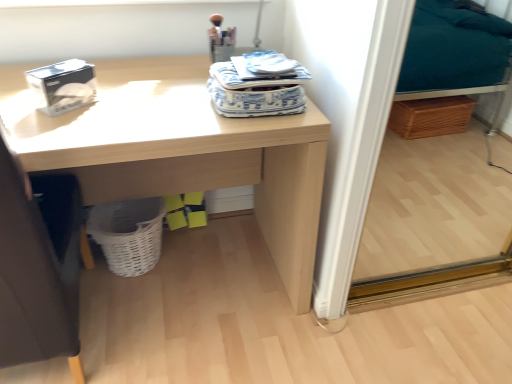
Identify the location of vacant area located to the right-hand side of light wood desk at center. The width and height of the screenshot is (512, 384). (375, 303).